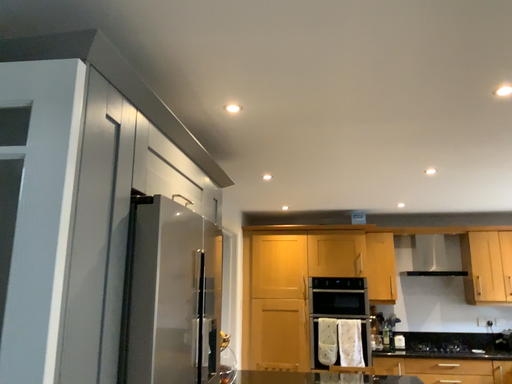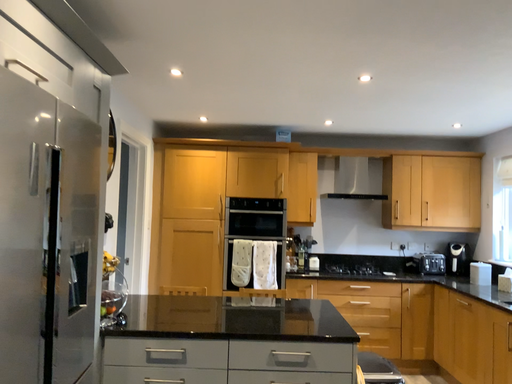
Question: How did the camera likely rotate when shooting the video?

Choices:
 (A) rotated left
 (B) rotated right

Answer: (B)